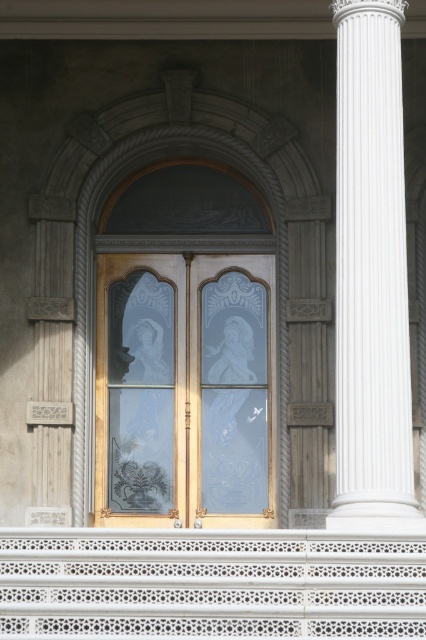
Is point (304, 547) more distant than point (411, 525)?

No, it is in front of (411, 525).

What do you see at coordinates (210, 582) in the screenshot? This screenshot has width=426, height=640. I see `white lace balustrade at lower center` at bounding box center [210, 582].

Locate an element on the screen. white lace balustrade at lower center is located at coordinates (210, 582).

Which is in front, point (261, 484) or point (215, 576)?

Point (215, 576)

Between clear glass window at center and white lace balustrade at lower center, which one has less height?

With less height is white lace balustrade at lower center.

In the scene shown: Measure the distance between point (233,342) and camera.

Point (233,342) is 55.02 meters from camera.

Image resolution: width=426 pixels, height=640 pixels. Identify the location of clear glass window at center. (184, 388).

Does clear glass window at center have a larger size compared to white marble column at right?

Incorrect, clear glass window at center is not larger than white marble column at right.

This screenshot has width=426, height=640. Identify the location of clear glass window at center. (184, 388).